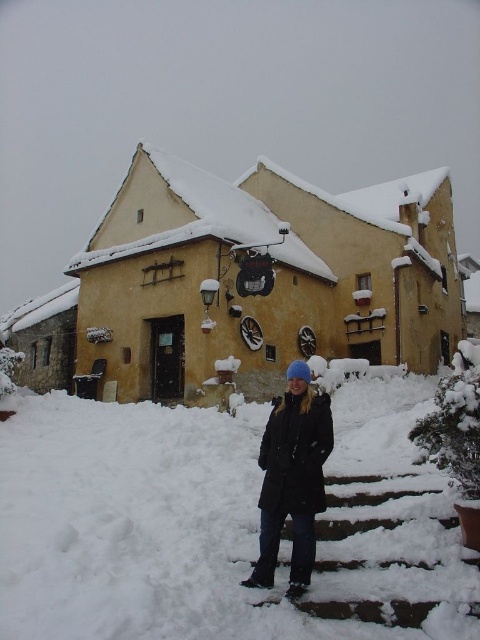
Question: Can you confirm if white fluffy snow at lower center is smaller than black matte coat at lower center?

Choices:
 (A) no
 (B) yes

Answer: (A)

Question: Estimate the real-world distances between objects in this image. Which object is closer to the snow-covered stone stairs at lower center?

Choices:
 (A) black matte coat at lower center
 (B) white fluffy snow at lower center

Answer: (A)

Question: Does snow-covered stone stairs at lower center have a larger size compared to black matte coat at lower center?

Choices:
 (A) no
 (B) yes

Answer: (A)

Question: Which of these objects is positioned farthest from the black matte coat at lower center?

Choices:
 (A) snow-covered stone stairs at lower center
 (B) white fluffy snow at lower center

Answer: (B)

Question: Which point is farther to the camera?

Choices:
 (A) snow-covered stone stairs at lower center
 (B) black matte coat at lower center

Answer: (B)

Question: Can you confirm if snow-covered stone stairs at lower center is smaller than black matte coat at lower center?

Choices:
 (A) yes
 (B) no

Answer: (A)